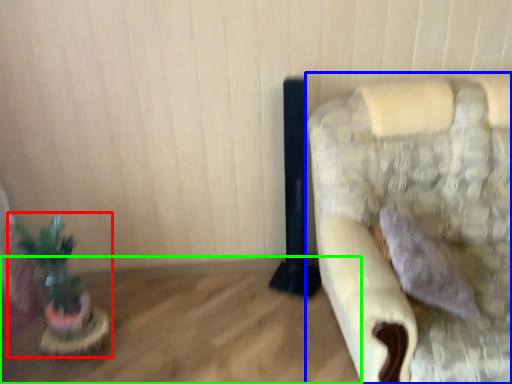
Question: Which object is the closest to the houseplant (highlighted by a red box)? Choose among these: furniture (highlighted by a blue box) or table (highlighted by a green box).

Choices:
 (A) furniture
 (B) table

Answer: (B)